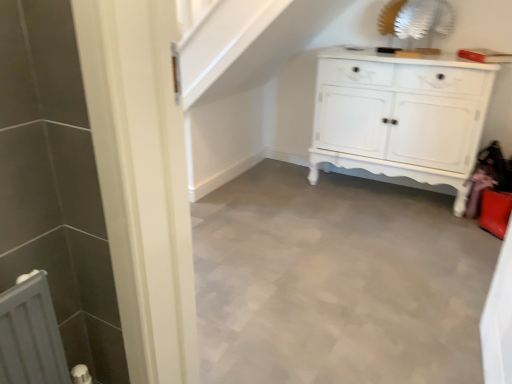
Question: From the image's perspective, is white painted wood cabinet at center positioned above or below white matte radiator at lower left?

Choices:
 (A) below
 (B) above

Answer: (B)

Question: Is white painted wood cabinet at center to the left or to the right of white matte radiator at lower left in the image?

Choices:
 (A) left
 (B) right

Answer: (B)

Question: Which is farther from the smooth gray floor at center?

Choices:
 (A) white painted wood cabinet at center
 (B) white matte radiator at lower left

Answer: (B)

Question: Estimate the real-world distances between objects in this image. Which object is farther from the white matte radiator at lower left?

Choices:
 (A) smooth gray floor at center
 (B) white painted wood cabinet at center

Answer: (B)